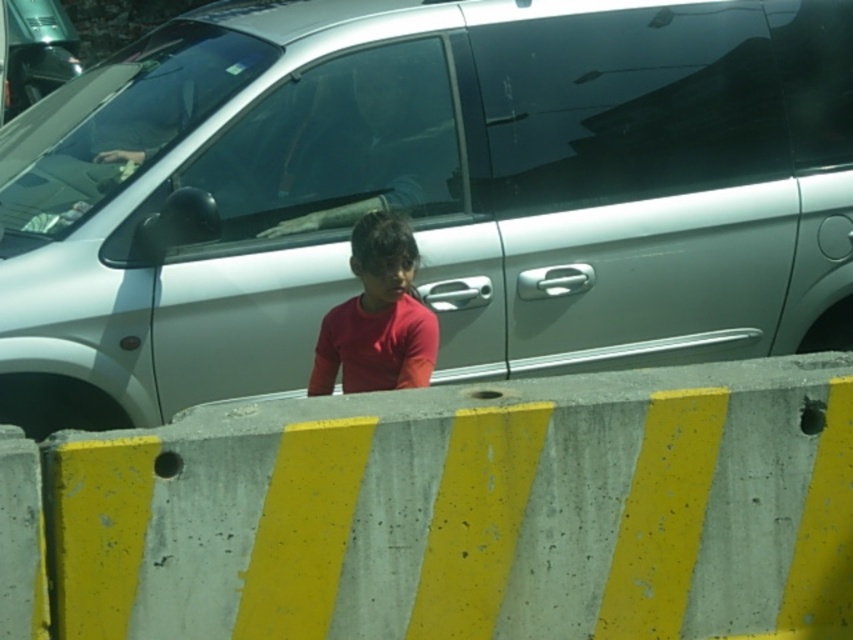
Question: Which object is the farthest from the red matte shirt at center?

Choices:
 (A) silver metallic car at center
 (B) concrete/yellow striped barrier at center

Answer: (B)

Question: Can you confirm if concrete/yellow striped barrier at center is positioned above red matte shirt at center?

Choices:
 (A) no
 (B) yes

Answer: (A)

Question: Which point is closer to the camera taking this photo?

Choices:
 (A) (753, 577)
 (B) (408, 320)

Answer: (A)

Question: Is silver metallic car at center positioned in front of red matte shirt at center?

Choices:
 (A) yes
 (B) no

Answer: (B)

Question: Can you confirm if silver metallic car at center is positioned below red matte shirt at center?

Choices:
 (A) no
 (B) yes

Answer: (A)

Question: Which of these objects is positioned closest to the silver metallic car at center?

Choices:
 (A) red matte shirt at center
 (B) concrete/yellow striped barrier at center

Answer: (A)